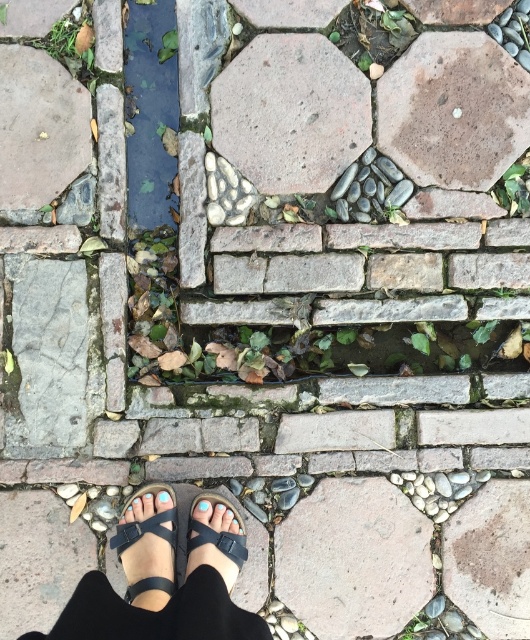
Consider the image. You are a gardener inspecting the stone pathway and notice two stones labeled as smooth gray stone at center and smooth gray stone at upper center. Which stone is located directly above the other?

The smooth gray stone at upper center is positioned above the smooth gray stone at center.